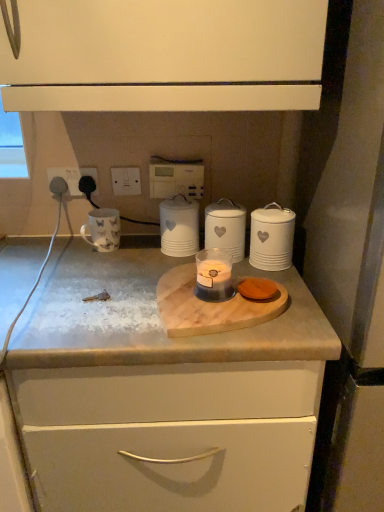
Describe the element at coordinates (226, 228) in the screenshot. I see `white textured canister at center, positioned as the second home appliance in right-to-left order` at that location.

Image resolution: width=384 pixels, height=512 pixels. I want to click on white plastic switch at upper center, the first electric outlet in the right-to-left sequence, so click(126, 180).

In order to face white glossy mug at left, should I rotate leftwards or rightwards?

To face it directly, rotate left by 12.118 degrees.

The width and height of the screenshot is (384, 512). In order to click on white glossy mug at left in this screenshot , I will do `click(102, 229)`.

Measure the distance between black plastic socket at upper left, the 2th electric outlet from the right, and camera.

black plastic socket at upper left, the 2th electric outlet from the right, is 1.23 meters away from camera.

You are a GUI agent. You are given a task and a screenshot of the screen. Output one action in this format:
    pyautogui.click(x=<x>, y=<y>)
    Task: Click on the white textured canister at center, positioned as the second home appliance in right-to-left order
    
    Given the screenshot: What is the action you would take?
    pyautogui.click(x=226, y=228)

Looking at this image, how many degrees apart are the facing directions of white textured canister at center, acting as the 2th home appliance starting from the left, and white matte canister at center, which is counted as the 3th home appliance, starting from the right?

white textured canister at center, acting as the 2th home appliance starting from the left, and white matte canister at center, which is counted as the 3th home appliance, starting from the right, are facing 0.0019 degrees away from each other.

Does white textured canister at center, positioned as the second home appliance in right-to-left order, have a greater height compared to white matte canister at center, which is the first home appliance in left-to-right order?

Incorrect, the height of white textured canister at center, positioned as the second home appliance in right-to-left order, is not larger of that of white matte canister at center, which is the first home appliance in left-to-right order.

From the image's perspective, which one is positioned higher, white textured canister at center, acting as the 2th home appliance starting from the left, or white matte canister at center, which is counted as the 3th home appliance, starting from the right?

From the image's view, white matte canister at center, which is counted as the 3th home appliance, starting from the right, is above.

You are a GUI agent. You are given a task and a screenshot of the screen. Output one action in this format:
    pyautogui.click(x=<x>, y=<y>)
    Task: Click on the electric outlet that appears on the right of white glossy mug at left
    This screenshot has width=384, height=512.
    Given the screenshot: What is the action you would take?
    pyautogui.click(x=126, y=180)

Is white plastic switch at upper center, positioned as the 3th electric outlet in left-to-right order, located within white glossy mug at left?

No, white plastic switch at upper center, positioned as the 3th electric outlet in left-to-right order, is not inside white glossy mug at left.

Are white glossy mug at left and white plastic switch at upper center, the first electric outlet in the right-to-left sequence, far apart?

That's not correct — white glossy mug at left is a little close to white plastic switch at upper center, the first electric outlet in the right-to-left sequence.

From a real-world perspective, is black plastic socket at upper left, positioned as the second electric outlet in left-to-right order, positioned above or below white matte canister at right, which appears as the third home appliance when viewed from the left?

From a real-world perspective, black plastic socket at upper left, positioned as the second electric outlet in left-to-right order, is physically above white matte canister at right, which appears as the third home appliance when viewed from the left.

Considering the relative sizes of black plastic socket at upper left, positioned as the second electric outlet in left-to-right order, and white matte canister at right, which appears as the third home appliance when viewed from the left, in the image provided, is black plastic socket at upper left, positioned as the second electric outlet in left-to-right order, thinner than white matte canister at right, which appears as the third home appliance when viewed from the left,?

Correct, the width of black plastic socket at upper left, positioned as the second electric outlet in left-to-right order, is less than that of white matte canister at right, which appears as the third home appliance when viewed from the left.

Which is closer to the camera, (x=82, y=184) or (x=281, y=247)?

Point (x=82, y=184) is positioned farther from the camera compared to point (x=281, y=247).

Which object is closer to the camera, black plastic socket at upper left, positioned as the second electric outlet in left-to-right order, or white matte canister at right, which appears as the third home appliance when viewed from the left?

white matte canister at right, which appears as the third home appliance when viewed from the left.

From the image's perspective, between white textured canister at center, acting as the 2th home appliance starting from the left, and white plastic socket at upper left, the 1th electric outlet viewed from the left, which one is located above?

white plastic socket at upper left, the 1th electric outlet viewed from the left.

Looking at their sizes, would you say white textured canister at center, acting as the 2th home appliance starting from the left, is wider or thinner than white plastic socket at upper left, positioned as the third electric outlet in right-to-left order?

white textured canister at center, acting as the 2th home appliance starting from the left, is wider than white plastic socket at upper left, positioned as the third electric outlet in right-to-left order.

Is white plastic socket at upper left, positioned as the third electric outlet in right-to-left order, inside white textured canister at center, positioned as the second home appliance in right-to-left order?

No, white plastic socket at upper left, positioned as the third electric outlet in right-to-left order, is located outside of white textured canister at center, positioned as the second home appliance in right-to-left order.

Does white textured canister at center, acting as the 2th home appliance starting from the left, come in front of white plastic socket at upper left, positioned as the third electric outlet in right-to-left order?

Yes, it is.

Could you tell me if white plastic socket at upper left, the 1th electric outlet viewed from the left, is facing translucent glass candle at center?

No, white plastic socket at upper left, the 1th electric outlet viewed from the left, is not aimed at translucent glass candle at center.

From a real-world perspective, is white plastic socket at upper left, positioned as the third electric outlet in right-to-left order, located beneath translucent glass candle at center?

No, from a real-world perspective, white plastic socket at upper left, positioned as the third electric outlet in right-to-left order, is not beneath translucent glass candle at center.

Are white plastic socket at upper left, the 1th electric outlet viewed from the left, and translucent glass candle at center located far from each other?

No, white plastic socket at upper left, the 1th electric outlet viewed from the left, is not far away from translucent glass candle at center.

In the scene shown: Considering the sizes of objects white plastic socket at upper left, positioned as the third electric outlet in right-to-left order, and translucent glass candle at center in the image provided, who is smaller, white plastic socket at upper left, positioned as the third electric outlet in right-to-left order, or translucent glass candle at center?

Smaller between the two is white plastic socket at upper left, positioned as the third electric outlet in right-to-left order.

Considering the relative positions of black plastic socket at upper left, positioned as the second electric outlet in left-to-right order, and white plastic switch at upper center, positioned as the 3th electric outlet in left-to-right order, in the image provided, is black plastic socket at upper left, positioned as the second electric outlet in left-to-right order, to the right of white plastic switch at upper center, positioned as the 3th electric outlet in left-to-right order, from the viewer's perspective?

No, black plastic socket at upper left, positioned as the second electric outlet in left-to-right order, is not to the right of white plastic switch at upper center, positioned as the 3th electric outlet in left-to-right order.

From a real-world perspective, is black plastic socket at upper left, the 2th electric outlet from the right, on white plastic switch at upper center, the first electric outlet in the right-to-left sequence?

No.

Can you confirm if black plastic socket at upper left, positioned as the second electric outlet in left-to-right order, is bigger than white plastic switch at upper center, the first electric outlet in the right-to-left sequence?

Actually, black plastic socket at upper left, positioned as the second electric outlet in left-to-right order, might be smaller than white plastic switch at upper center, the first electric outlet in the right-to-left sequence.

Can you confirm if black plastic socket at upper left, the 2th electric outlet from the right, is taller than white plastic switch at upper center, positioned as the 3th electric outlet in left-to-right order?

Incorrect, the height of black plastic socket at upper left, the 2th electric outlet from the right, is not larger of that of white plastic switch at upper center, positioned as the 3th electric outlet in left-to-right order.

At what (x,y) coordinates should I click in order to perform the action: click on home appliance in front of the white textured canister at center, acting as the 2th home appliance starting from the left. Please return your answer as a coordinate pair (x, y). The height and width of the screenshot is (512, 384). Looking at the image, I should click on (x=272, y=237).

Is white matte canister at right, the first home appliance when ordered from right to left, positioned in front of white textured canister at center, positioned as the second home appliance in right-to-left order?

Yes, white matte canister at right, the first home appliance when ordered from right to left, is closer to the camera.

Is white matte canister at right, which appears as the third home appliance when viewed from the left, not close to white textured canister at center, acting as the 2th home appliance starting from the left?

Actually, white matte canister at right, which appears as the third home appliance when viewed from the left, and white textured canister at center, acting as the 2th home appliance starting from the left, are a little close together.

In terms of size, does white matte canister at right, which appears as the third home appliance when viewed from the left, appear bigger or smaller than white textured canister at center, positioned as the second home appliance in right-to-left order?

In the image, white matte canister at right, which appears as the third home appliance when viewed from the left, appears to be smaller than white textured canister at center, positioned as the second home appliance in right-to-left order.

At what (x,y) coordinates should I click in order to perform the action: click on home appliance that is the 1st one when counting rightward from the white matte canister at center, which is counted as the 3th home appliance, starting from the right. Please return your answer as a coordinate pair (x, y). Image resolution: width=384 pixels, height=512 pixels. Looking at the image, I should click on (226, 228).

From the image's perspective, starting from the white glossy mug at left, which electric outlet is the 3rd one above? Please provide its 2D coordinates.

[(126, 180)]

Which object lies further to the anchor point white matte canister at right, which appears as the third home appliance when viewed from the left, white textured canister at center, acting as the 2th home appliance starting from the left, or white glossy mug at left?

white glossy mug at left is positioned further to the anchor white matte canister at right, which appears as the third home appliance when viewed from the left.

Looking at the image, which one is located closer to white textured canister at center, acting as the 2th home appliance starting from the left, black plastic socket at upper left, the 2th electric outlet from the right, or white glossy mug at left?

Among the two, white glossy mug at left is located nearer to white textured canister at center, acting as the 2th home appliance starting from the left.

Considering their positions, is white matte canister at right, the first home appliance when ordered from right to left, positioned further to translucent glass candle at center than white textured canister at center, positioned as the second home appliance in right-to-left order?

white matte canister at right, the first home appliance when ordered from right to left, is further to translucent glass candle at center.

Looking at the image, which one is located further to white plastic socket at upper left, positioned as the third electric outlet in right-to-left order, white matte canister at right, which appears as the third home appliance when viewed from the left, or translucent glass candle at center?

white matte canister at right, which appears as the third home appliance when viewed from the left, is further to white plastic socket at upper left, positioned as the third electric outlet in right-to-left order.

Based on their spatial positions, is white plastic socket at upper left, positioned as the third electric outlet in right-to-left order, or white plastic switch at upper center, the first electric outlet in the right-to-left sequence, further from translucent glass candle at center?

Based on the image, white plastic socket at upper left, positioned as the third electric outlet in right-to-left order, appears to be further to translucent glass candle at center.

Based on their spatial positions, is white plastic socket at upper left, the 1th electric outlet viewed from the left, or black plastic socket at upper left, the 2th electric outlet from the right, closer to white matte canister at center, which is the first home appliance in left-to-right order?

black plastic socket at upper left, the 2th electric outlet from the right, lies closer to white matte canister at center, which is the first home appliance in left-to-right order, than the other object.

Considering their positions, is white matte canister at center, which is counted as the 3th home appliance, starting from the right, positioned closer to white textured canister at center, acting as the 2th home appliance starting from the left, than white glossy mug at left?

white matte canister at center, which is counted as the 3th home appliance, starting from the right, is closer to white textured canister at center, acting as the 2th home appliance starting from the left.

When comparing their distances from white matte canister at right, the first home appliance when ordered from right to left, does white plastic socket at upper left, the 1th electric outlet viewed from the left, or white matte canister at center, which is counted as the 3th home appliance, starting from the right, seem further?

white plastic socket at upper left, the 1th electric outlet viewed from the left, is positioned further to the anchor white matte canister at right, the first home appliance when ordered from right to left.

This screenshot has width=384, height=512. I want to click on electric outlet between white glossy mug at left and white matte canister at center, which is the first home appliance in left-to-right order, from left to right, so click(x=126, y=180).

What are the coordinates of `appliance between black plastic socket at upper left, positioned as the second electric outlet in left-to-right order, and white matte canister at center, which is the first home appliance in left-to-right order, from left to right` in the screenshot? It's located at (102, 229).

Find the location of `appliance between white plastic socket at upper left, positioned as the third electric outlet in right-to-left order, and white matte canister at center, which is counted as the 3th home appliance, starting from the right`. appliance between white plastic socket at upper left, positioned as the third electric outlet in right-to-left order, and white matte canister at center, which is counted as the 3th home appliance, starting from the right is located at coordinates (102, 229).

Locate an element on the screen. appliance between black plastic socket at upper left, positioned as the second electric outlet in left-to-right order, and white matte canister at right, the first home appliance when ordered from right to left, from left to right is located at coordinates (102, 229).